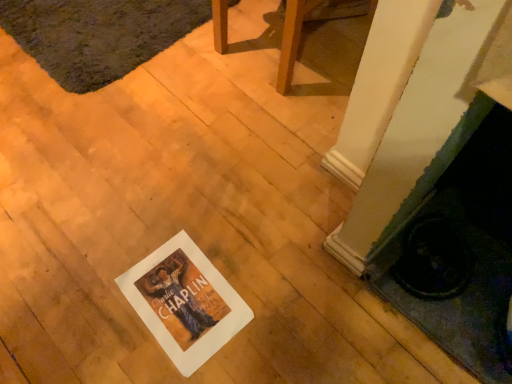
You are a GUI agent. You are given a task and a screenshot of the screen. Output one action in this format:
    pyautogui.click(x=<x>, y=<y>)
    Task: Click on the free space to the right of dark gray shaggy rug at upper left
    This screenshot has height=384, width=512.
    Given the screenshot: What is the action you would take?
    pyautogui.click(x=255, y=64)